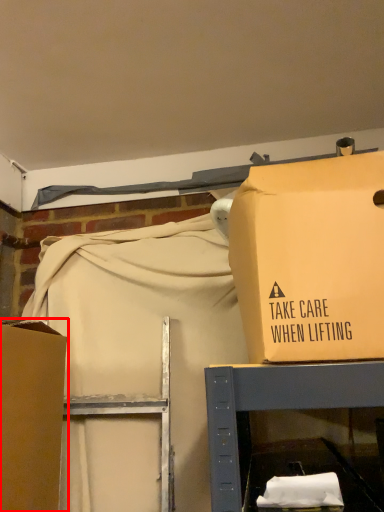
Question: From the image's perspective, what is the correct spatial positioning of box (annotated by the red box) in reference to box?

Choices:
 (A) below
 (B) above

Answer: (A)